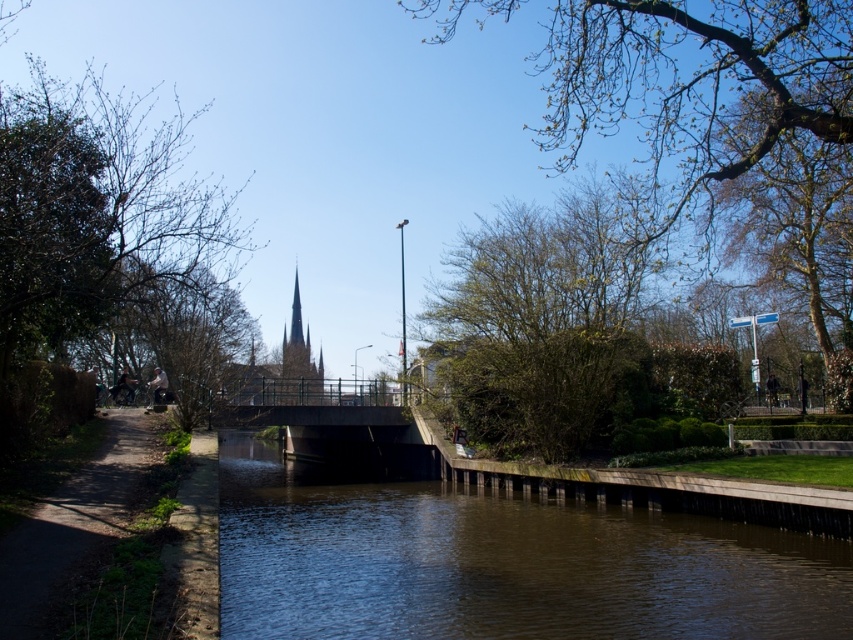
You are a bird flying over the canal and want to land on a tree. Which tree should you choose between the bare branches at left and the green leafy tree at upper right if you prefer a higher position?

The green leafy tree at upper right is higher than the bare branches at left, so you should choose the green leafy tree at upper right.

You are a hiker trying to reach the dark brown stone tower at center from the dirt path at left. According to the scene, which direction should you head to move towards the tower?

The dirt path at left is located below the dark brown stone tower at center, so you should head upwards towards the tower.

Where is the dirt path at left located in the image?

The dirt path at left is located at point (71, 525) in the image.